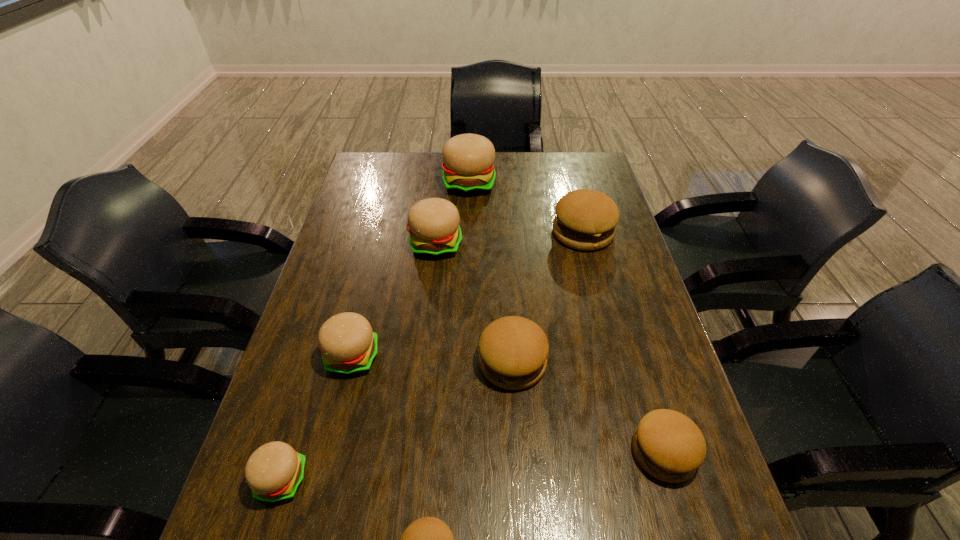
At what (x,y) coordinates should I click in order to perform the action: click on blank space located 0.280m on the front of the third smallest beige hamburger. Please return your answer as a coordinate pair (x, y). The height and width of the screenshot is (540, 960). Looking at the image, I should click on (425, 339).

Find the location of a particular element. free space located 0.090m on the left of the farthest brown hamburger is located at coordinates (524, 233).

In order to click on free spot located 0.390m on the right of the second nearest beige hamburger in this screenshot , I will do `click(540, 357)`.

Locate an element on the screen. free region located on the back of the third brown hamburger from right to left is located at coordinates (506, 267).

Identify the location of blank space located on the left of the third biggest brown hamburger. Image resolution: width=960 pixels, height=540 pixels. (475, 452).

Where is `vacant space located 0.400m on the right of the nearest beige hamburger`? This screenshot has height=540, width=960. vacant space located 0.400m on the right of the nearest beige hamburger is located at coordinates pyautogui.click(x=511, y=480).

Where is `object situated at the far edge`? object situated at the far edge is located at coordinates (468, 169).

Find the location of `vacant space at the far edge`. vacant space at the far edge is located at coordinates (426, 158).

Locate an element on the screen. vacant space at the left edge is located at coordinates (252, 534).

In the image, there is a desktop. At what (x,y) coordinates should I click in order to perform the action: click on vacant space at the right edge. Please return your answer as a coordinate pair (x, y). Looking at the image, I should click on (612, 249).